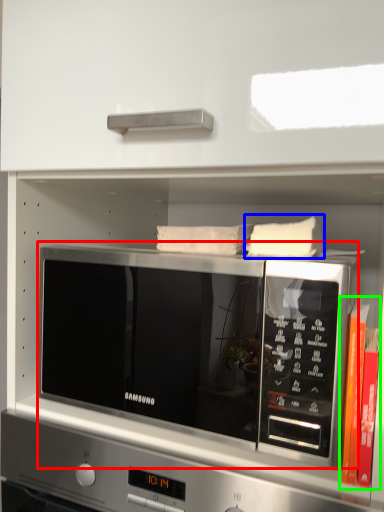
Question: Which object is the closest to the microwave oven (highlighted by a red box)? Choose among these: pillow (highlighted by a blue box) or book (highlighted by a green box).

Choices:
 (A) pillow
 (B) book

Answer: (A)